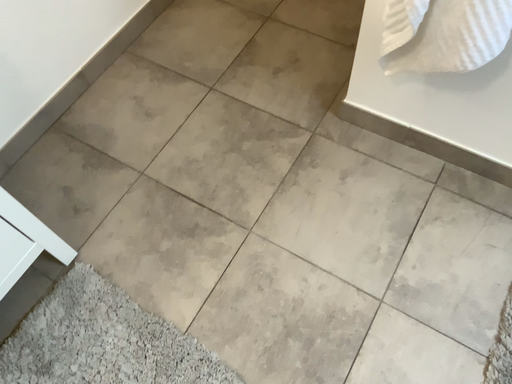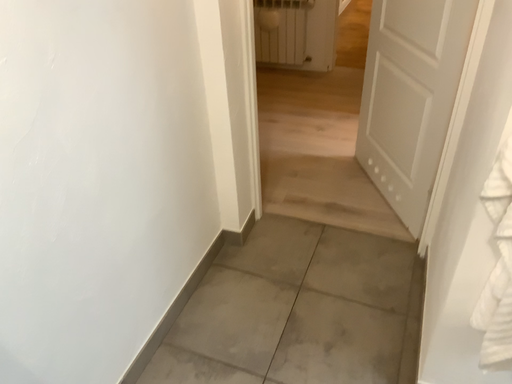
Question: Which way did the camera rotate in the video?

Choices:
 (A) rotated downward
 (B) rotated upward

Answer: (B)